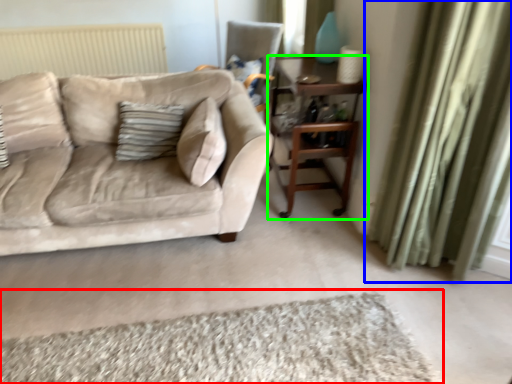
Question: Considering the real-world distances, which object is farthest from plain (highlighted by a red box)? curtain (highlighted by a blue box) or table (highlighted by a green box)?

Choices:
 (A) curtain
 (B) table

Answer: (B)